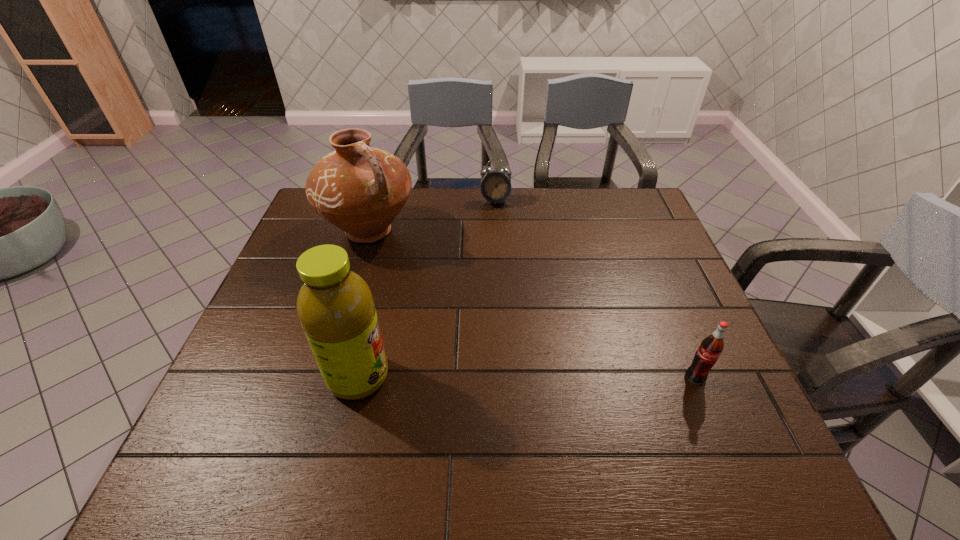
Locate an element on the screen. This screenshot has width=960, height=540. vacant space at the far edge of the desktop is located at coordinates (455, 194).

You are a GUI agent. You are given a task and a screenshot of the screen. Output one action in this format:
    pyautogui.click(x=<x>, y=<y>)
    Task: Click on the free space at the near edge of the desktop
    The image size is (960, 540).
    Given the screenshot: What is the action you would take?
    pyautogui.click(x=287, y=426)

This screenshot has height=540, width=960. In the image, there is a desktop. Find the location of `vacant region at the left edge`. vacant region at the left edge is located at coordinates (309, 239).

Where is `free space at the right edge`? free space at the right edge is located at coordinates (627, 231).

The image size is (960, 540). I want to click on vacant area at the far left corner of the desktop, so click(319, 224).

Identify the location of vacant area that lies between the third object from left to right and the fruit juice. The width and height of the screenshot is (960, 540). (427, 289).

This screenshot has height=540, width=960. Identify the location of free spot between the fruit juice and the shortest object. (427, 289).

Where is `empty space that is in between the second shortest object and the third object from left to right`? Image resolution: width=960 pixels, height=540 pixels. empty space that is in between the second shortest object and the third object from left to right is located at coordinates (595, 289).

You are a GUI agent. You are given a task and a screenshot of the screen. Output one action in this format:
    pyautogui.click(x=<x>, y=<y>)
    Task: Click on the vacant space that's between the pottery and the rightmost object
    The width and height of the screenshot is (960, 540).
    Given the screenshot: What is the action you would take?
    pyautogui.click(x=532, y=304)

This screenshot has width=960, height=540. What are the coordinates of `unoccupied position between the third object from left to right and the rightmost object` in the screenshot? It's located at (595, 289).